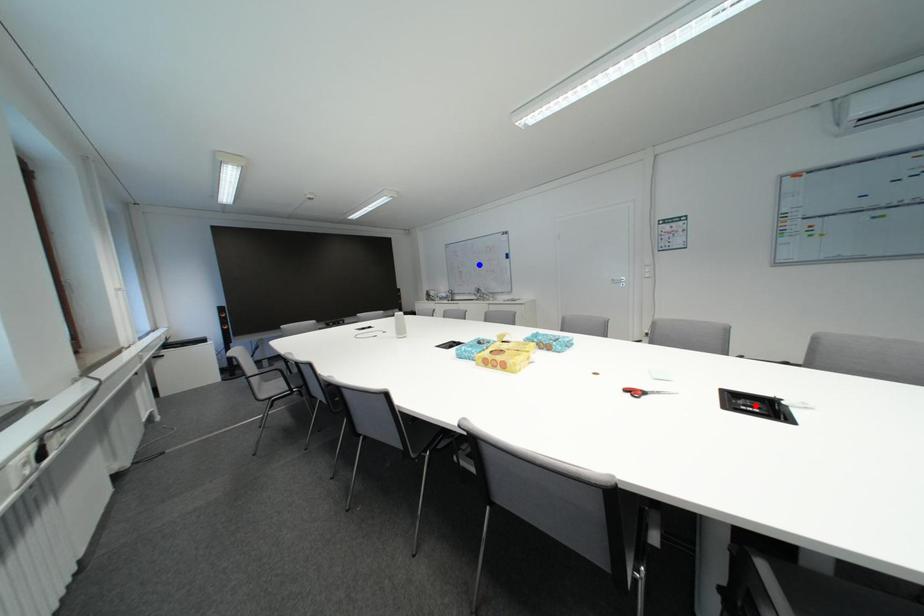
Question: Which of the two points in the image is closer to the camera?

Choices:
 (A) Blue point is closer.
 (B) Red point is closer.

Answer: (B)